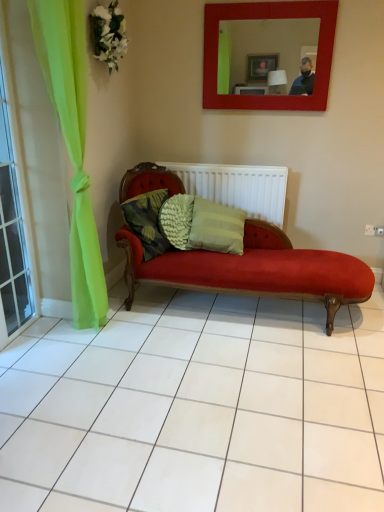
Question: Considering the positions of point (157, 236) and point (94, 48), is point (157, 236) closer or farther from the camera than point (94, 48)?

Choices:
 (A) farther
 (B) closer

Answer: (A)

Question: Is textured green pillow at center spatially inside white fabric flower at upper left, or outside of it?

Choices:
 (A) inside
 (B) outside

Answer: (B)

Question: Based on their relative distances, which object is nearer to the textured green pillow at center?

Choices:
 (A) white textured radiator at center
 (B) matte red mirror at upper center
 (C) clear glass window at left
 (D) white fabric flower at upper left

Answer: (A)

Question: Which object is the farthest from the white fabric flower at upper left?

Choices:
 (A) matte red mirror at upper center
 (B) textured green pillow at center
 (C) white textured radiator at center
 (D) clear glass window at left

Answer: (C)